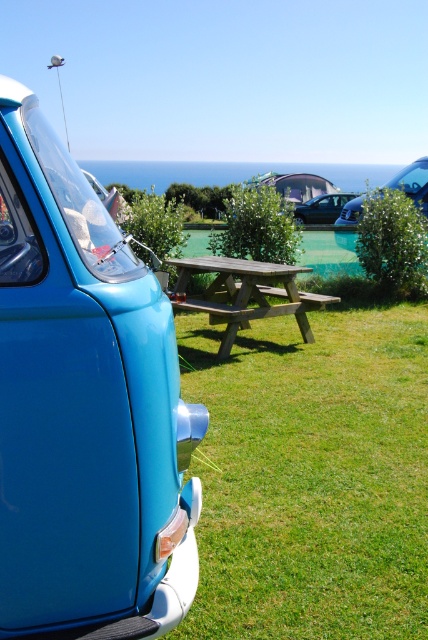
You are planning to set up a picnic and need to know the layout. Which object is located to the left of the other between the wooden picnic table at center and the metallic blue car at center?

The wooden picnic table at center is positioned on the left side of the metallic blue car at center.

You are standing at the picnic table and want to get to the matte blue minivan at left and the satin black car at center. Which vehicle is closer to you?

The matte blue minivan at left is closer to you than the satin black car at center.